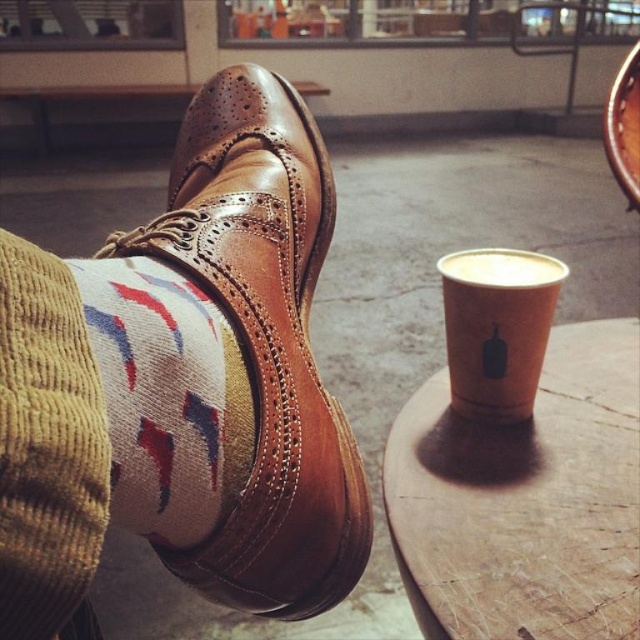
Question: Which object is farther from the camera taking this photo?

Choices:
 (A) brown leather shoe at center
 (B) white paper cup at center right
 (C) corduroy socks at lower left

Answer: (B)

Question: Is corduroy socks at lower left below white matte cup at center?

Choices:
 (A) no
 (B) yes

Answer: (B)

Question: Which object is farther from the camera taking this photo?

Choices:
 (A) white matte cup at center
 (B) wooden table at center
 (C) white paper cup at center right
 (D) brown leather shoe at center

Answer: (A)

Question: Does wooden table at center come behind white paper cup at center right?

Choices:
 (A) no
 (B) yes

Answer: (A)

Question: Can you confirm if wooden table at center is bigger than corduroy socks at lower left?

Choices:
 (A) yes
 (B) no

Answer: (A)

Question: Which point is closer to the camera?

Choices:
 (A) wooden table at center
 (B) white matte cup at center

Answer: (A)